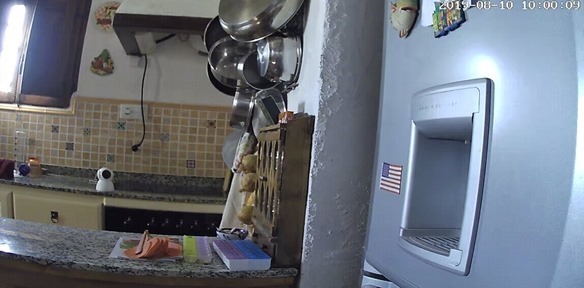
Identify the location of water/ice dispenser for the fridge. Image resolution: width=584 pixels, height=288 pixels. (451, 197).